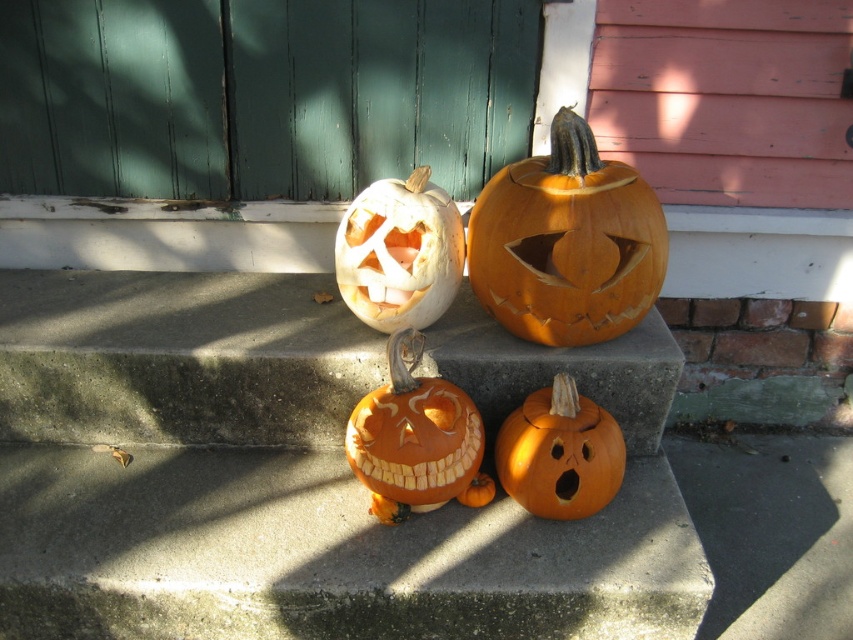
In the scene shown: You are a child who wants to place a new small pumpkin between the white matte carved pumpkin at center and the orange matte pumpkin at center. Which pumpkin should you place it closer to if you want the new pumpkin to be shorter than both?

You should place the new small pumpkin closer to the orange matte pumpkin at center because the white matte carved pumpkin at center is taller than the orange matte pumpkin at center, so the orange one is shorter. Placing it closer to the shorter one ensures the new pumpkin remains shorter than both.

You are standing in front of the carved pumpkins on the concrete step. You want to place a new pumpkin exactly at the point marked by the coordinates point (416, 440). Which carved pumpkin is already occupying that spot?

The orange matte carved pumpkin at center is located at point (416, 440), so that pumpkin is already occupying the spot.

You are standing in front of the carved pumpkins on the concrete step. You notice two points marked on the image at coordinates point (575, 310) and point (505, 484). Which point is closer to you?

Point (575, 310) is closer to the viewer than point (505, 484).